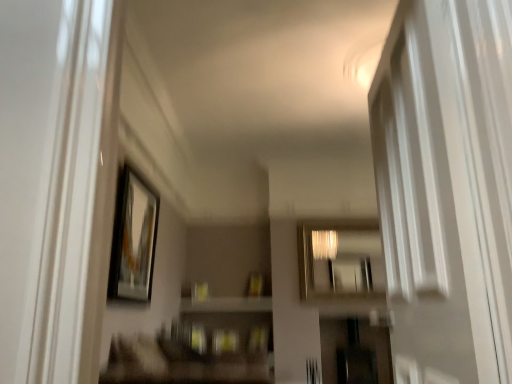
What do you see at coordinates (447, 188) in the screenshot? The width and height of the screenshot is (512, 384). I see `white glossy screen door at right` at bounding box center [447, 188].

The height and width of the screenshot is (384, 512). I want to click on matte black picture frame at upper left, so click(x=133, y=238).

Where is `white glossy screen door at right`? The image size is (512, 384). white glossy screen door at right is located at coordinates (447, 188).

Considering the sizes of objects metallic reflective mirror at center and matte black picture frame at upper left in the image provided, who is bigger, metallic reflective mirror at center or matte black picture frame at upper left?

Result: With larger size is metallic reflective mirror at center.

The height and width of the screenshot is (384, 512). Identify the location of picture frame below the metallic reflective mirror at center (from a real-world perspective). (133, 238).

Is the depth of metallic reflective mirror at center less than that of matte black picture frame at upper left?

No, the depth of metallic reflective mirror at center is greater than that of matte black picture frame at upper left.

How far apart are metallic reflective mirror at center and matte black picture frame at upper left?

metallic reflective mirror at center is 2.69 meters from matte black picture frame at upper left.

From a real-world perspective, which object stands above the other?

metallic reflective mirror at center is physically above.

Is white glossy screen door at right completely or partially outside of metallic reflective mirror at center?

Indeed, white glossy screen door at right is completely outside metallic reflective mirror at center.

Is there a large distance between white glossy screen door at right and metallic reflective mirror at center?

Absolutely, white glossy screen door at right is distant from metallic reflective mirror at center.

From a real-world perspective, who is located lower, metallic reflective mirror at center or white glossy screen door at right?

From a 3D spatial view, white glossy screen door at right is below.

Considering the positions of point (377, 287) and point (441, 146), is point (377, 287) closer or farther from the camera than point (441, 146)?

Point (377, 287) appears to be farther away from the viewer than point (441, 146).

Is metallic reflective mirror at center spatially inside white glossy screen door at right, or outside of it?

metallic reflective mirror at center is located beyond the bounds of white glossy screen door at right.

Considering the relative sizes of metallic reflective mirror at center and white glossy screen door at right in the image provided, is metallic reflective mirror at center thinner than white glossy screen door at right?

Yes, metallic reflective mirror at center is thinner than white glossy screen door at right.

Is matte black picture frame at upper left to the left of white glossy screen door at right from the viewer's perspective?

Indeed, matte black picture frame at upper left is positioned on the left side of white glossy screen door at right.

How many degrees apart are the facing directions of matte black picture frame at upper left and white glossy screen door at right?

The facing directions of matte black picture frame at upper left and white glossy screen door at right are 174 degrees apart.

Which of these two, matte black picture frame at upper left or white glossy screen door at right, stands taller?

Standing taller between the two is white glossy screen door at right.

Is the position of matte black picture frame at upper left less distant than that of white glossy screen door at right?

No, it is not.

Looking at this image, do you think matte black picture frame at upper left is within metallic reflective mirror at center, or outside of it?

matte black picture frame at upper left is located beyond the bounds of metallic reflective mirror at center.

Between matte black picture frame at upper left and metallic reflective mirror at center, which one has less height?

Standing shorter between the two is metallic reflective mirror at center.

Considering the relative sizes of matte black picture frame at upper left and metallic reflective mirror at center in the image provided, is matte black picture frame at upper left smaller than metallic reflective mirror at center?

Yes, matte black picture frame at upper left is smaller than metallic reflective mirror at center.

From a real-world perspective, is matte black picture frame at upper left below metallic reflective mirror at center?

Yes.

Is matte black picture frame at upper left a part of white glossy screen door at right?

No, matte black picture frame at upper left is not a part of white glossy screen door at right.

Which point is more distant from viewer, (394, 78) or (129, 268)?

Point (129, 268)

Does white glossy screen door at right have a larger size compared to matte black picture frame at upper left?

Indeed, white glossy screen door at right has a larger size compared to matte black picture frame at upper left.

How different are the orientations of white glossy screen door at right and matte black picture frame at upper left in degrees?

The angular difference between white glossy screen door at right and matte black picture frame at upper left is 174 degrees.

Image resolution: width=512 pixels, height=384 pixels. I want to click on mirror behind the matte black picture frame at upper left, so click(340, 260).

The height and width of the screenshot is (384, 512). Identify the location of mirror located on the right of white glossy screen door at right. (340, 260).

Considering their positions, is matte black picture frame at upper left positioned closer to white glossy screen door at right than metallic reflective mirror at center?

matte black picture frame at upper left lies closer to white glossy screen door at right than the other object.

From the image, which object appears to be nearer to matte black picture frame at upper left, white glossy screen door at right or metallic reflective mirror at center?

white glossy screen door at right.

Considering their positions, is white glossy screen door at right positioned further to metallic reflective mirror at center than matte black picture frame at upper left?

white glossy screen door at right lies further to metallic reflective mirror at center than the other object.

From the image, which object appears to be farther from metallic reflective mirror at center, matte black picture frame at upper left or white glossy screen door at right?

Among the two, white glossy screen door at right is located further to metallic reflective mirror at center.

Which object lies further to the anchor point white glossy screen door at right, metallic reflective mirror at center or matte black picture frame at upper left?

metallic reflective mirror at center lies further to white glossy screen door at right than the other object.

Based on their spatial positions, is metallic reflective mirror at center or white glossy screen door at right further from matte black picture frame at upper left?

metallic reflective mirror at center lies further to matte black picture frame at upper left than the other object.

Where is `picture frame between white glossy screen door at right and metallic reflective mirror at center along the z-axis`? picture frame between white glossy screen door at right and metallic reflective mirror at center along the z-axis is located at coordinates (133, 238).